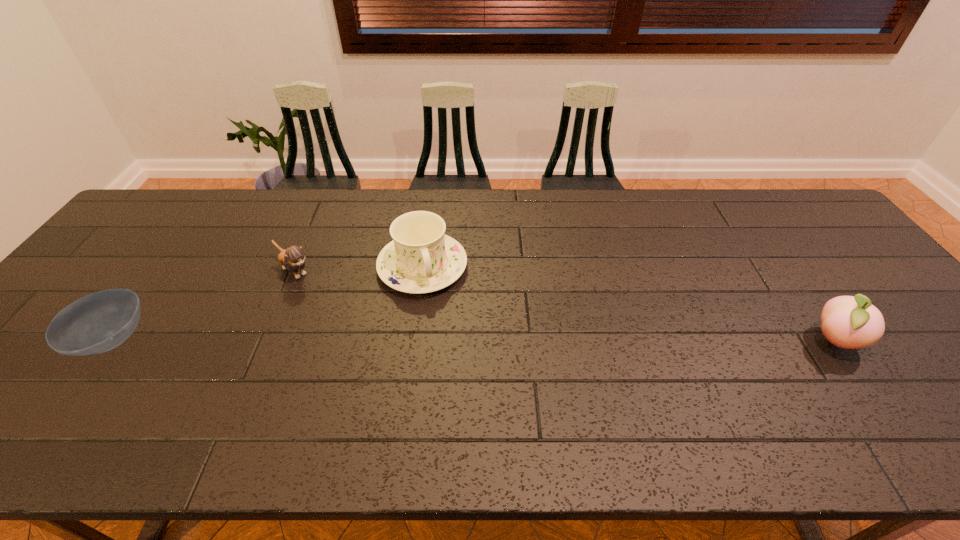
Image resolution: width=960 pixels, height=540 pixels. In the image, there is a desktop. In order to click on vacant space at the right edge in this screenshot , I will do `click(813, 246)`.

Identify the location of vacant space at the near right corner. The height and width of the screenshot is (540, 960). (957, 382).

Locate an element on the screen. The image size is (960, 540). vacant space that is in between the peach and the kitten is located at coordinates (564, 306).

Find the location of `free area in between the third object from left to right and the third tallest object`. free area in between the third object from left to right and the third tallest object is located at coordinates (359, 269).

Locate an element on the screen. The image size is (960, 540). vacant region between the peach and the second shortest object is located at coordinates (564, 306).

You are a GUI agent. You are given a task and a screenshot of the screen. Output one action in this format:
    pyautogui.click(x=<x>, y=<y>)
    Task: Click on the vacant area that lies between the rightmost object and the kitten
    The height and width of the screenshot is (540, 960).
    Given the screenshot: What is the action you would take?
    pyautogui.click(x=564, y=306)

You are a GUI agent. You are given a task and a screenshot of the screen. Output one action in this format:
    pyautogui.click(x=<x>, y=<y>)
    Task: Click on the free space between the peach and the chinaware
    
    Given the screenshot: What is the action you would take?
    pyautogui.click(x=628, y=303)

Find the location of a particular element. This screenshot has width=960, height=540. free space between the peach and the kitten is located at coordinates (564, 306).

Image resolution: width=960 pixels, height=540 pixels. Find the location of `free space between the chinaware and the second object from left to right`. free space between the chinaware and the second object from left to right is located at coordinates click(x=359, y=269).

This screenshot has width=960, height=540. Find the location of `free spot between the bowl and the third object from left to right`. free spot between the bowl and the third object from left to right is located at coordinates (268, 303).